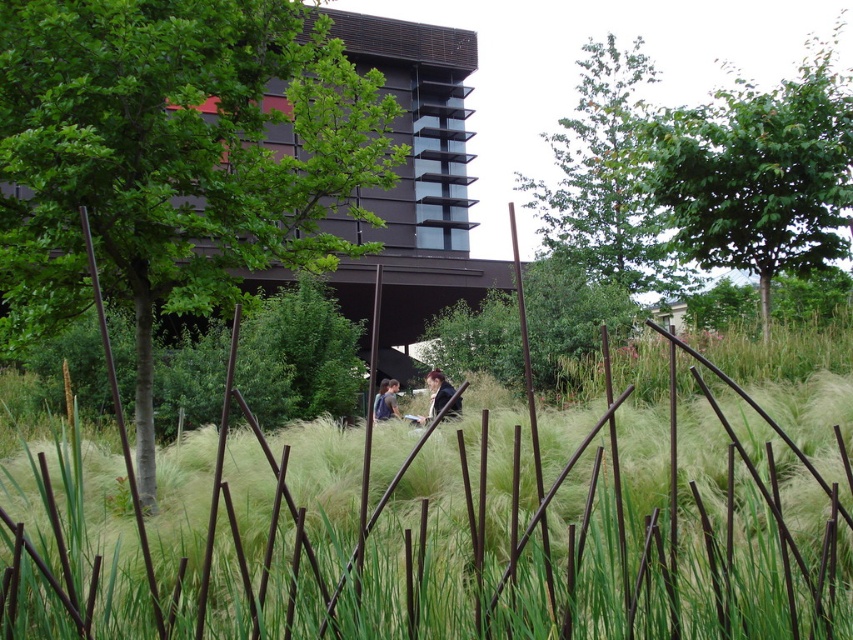
Is dark brown leather jacket at center thinner than blue denim jacket at center?

No.

Can you confirm if dark brown leather jacket at center is wider than blue denim jacket at center?

Correct, the width of dark brown leather jacket at center exceeds that of blue denim jacket at center.

Is point (439, 376) farther from camera compared to point (397, 381)?

No, (439, 376) is in front of (397, 381).

Find the location of a particular element. dark brown leather jacket at center is located at coordinates (438, 392).

Who is positioned more to the right, blue denim jacket at center or dark blue jacket at center?

Positioned to the right is blue denim jacket at center.

Between blue denim jacket at center and dark blue jacket at center, which one appears on the left side from the viewer's perspective?

Positioned to the left is dark blue jacket at center.

Describe the element at coordinates (387, 401) in the screenshot. I see `blue denim jacket at center` at that location.

Where is `blue denim jacket at center`? This screenshot has width=853, height=640. blue denim jacket at center is located at coordinates (387, 401).

Who is positioned more to the left, green leafy tree at center or green leafy tree at upper center?

green leafy tree at center

Is green leafy tree at center behind green leafy tree at upper center?

No.

Does point (15, 28) lie in front of point (618, 259)?

Yes, point (15, 28) is in front of point (618, 259).

The image size is (853, 640). In order to click on green leafy tree at center in this screenshot , I will do `click(173, 157)`.